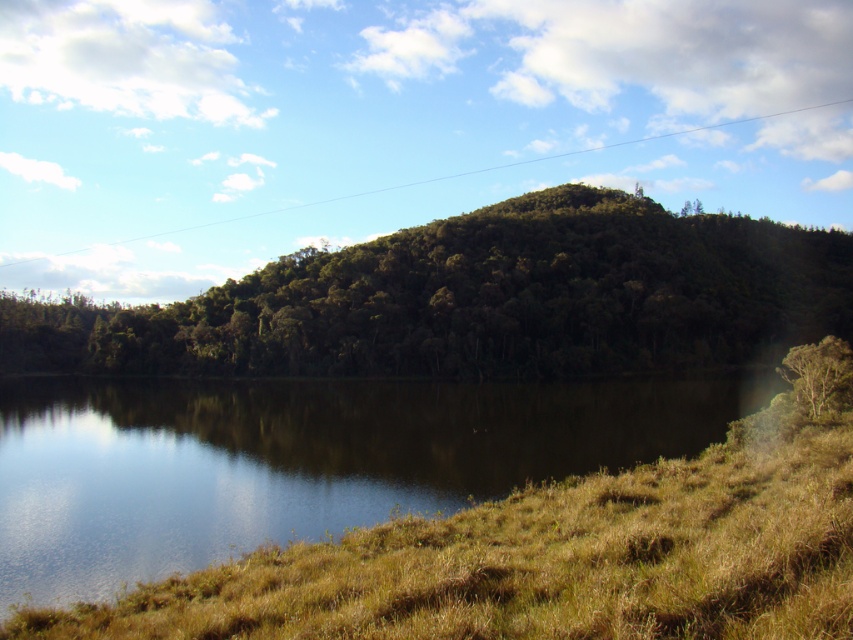
Does green leafy tree at center have a lesser width compared to green leafy tree at right?

Incorrect, green leafy tree at center's width is not less than green leafy tree at right's.

Does green leafy tree at center appear under green leafy tree at right?

No, green leafy tree at center is not below green leafy tree at right.

Between point (500, 280) and point (793, 365), which one is positioned behind?

Point (500, 280)

I want to click on green leafy tree at center, so click(x=479, y=300).

Between green grassy water at lower left and green leafy tree at center, which one has more height?

Standing taller between the two is green leafy tree at center.

Is green grassy water at lower left further to camera compared to green leafy tree at center?

No, green grassy water at lower left is in front of green leafy tree at center.

Which is in front, point (666, 449) or point (189, 326)?

Point (666, 449) is more forward.

This screenshot has width=853, height=640. I want to click on green grassy water at lower left, so click(x=299, y=460).

Does green grassy water at lower left have a smaller size compared to green leafy tree at right?

No.

Does point (367, 435) come closer to viewer compared to point (820, 380)?

No, it is behind (820, 380).

You are a GUI agent. You are given a task and a screenshot of the screen. Output one action in this format:
    pyautogui.click(x=<x>, y=<y>)
    Task: Click on the green grassy water at lower left
    Image resolution: width=853 pixels, height=640 pixels.
    Given the screenshot: What is the action you would take?
    pyautogui.click(x=299, y=460)